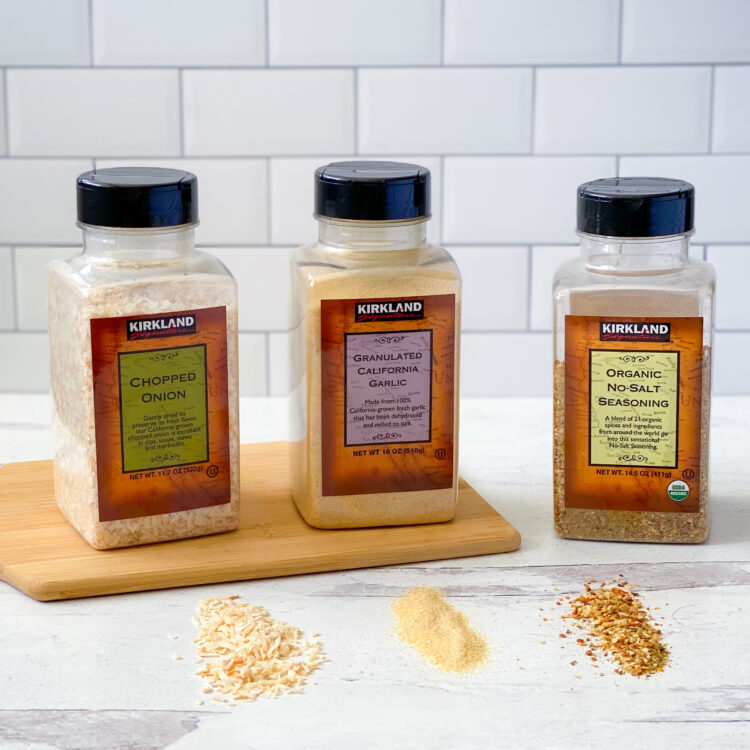
The image size is (750, 750). What are the coordinates of `gray grout` in the screenshot? It's located at (535, 64), (528, 325), (267, 331), (14, 310).